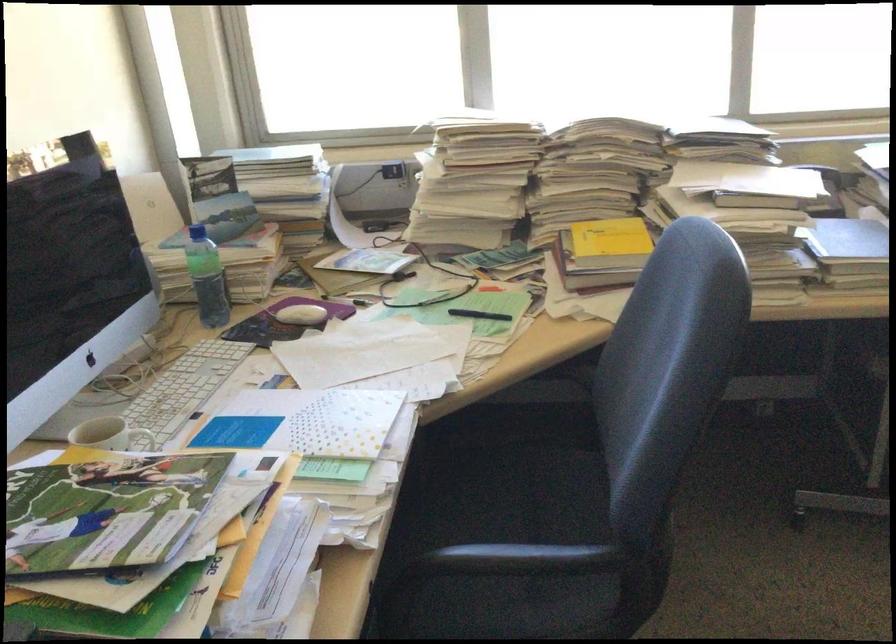
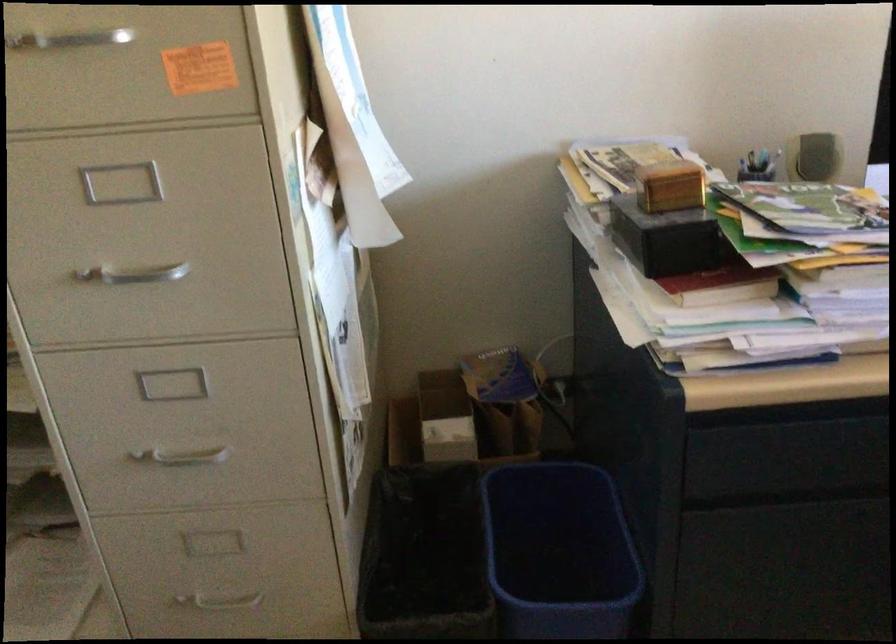
The images are taken continuously from a first-person perspective. In which direction is your viewpoint rotating?

The camera's rotation is toward left-down.